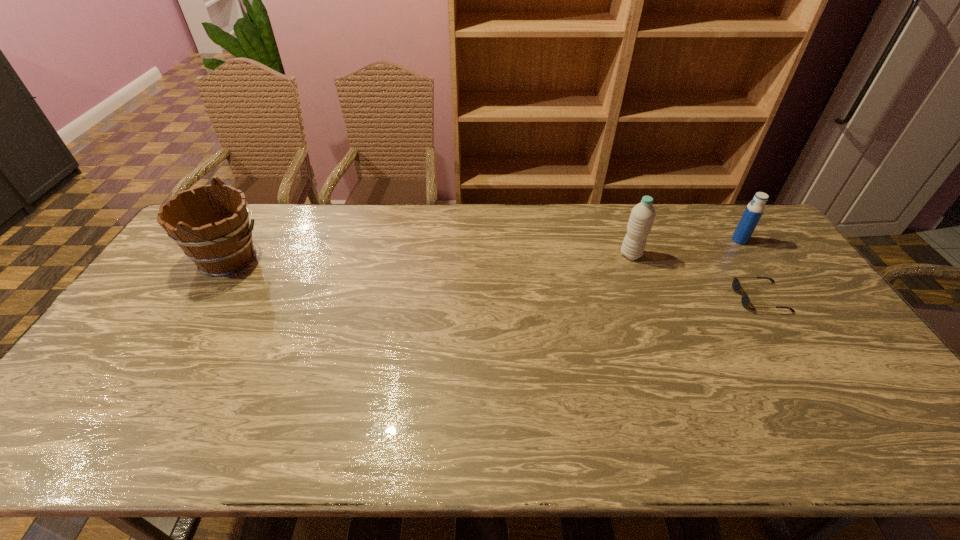
Identify the location of free space between the left water bottle and the sunglasses. (696, 276).

Where is `blank region between the wine bucket and the sunglasses`? This screenshot has height=540, width=960. blank region between the wine bucket and the sunglasses is located at coordinates (494, 278).

You are a GUI agent. You are given a task and a screenshot of the screen. Output one action in this format:
    pyautogui.click(x=<x>, y=<y>)
    Task: Click on the vacant area between the farther water bottle and the wine bucket
    
    Given the screenshot: What is the action you would take?
    pyautogui.click(x=484, y=249)

At what (x,y) coordinates should I click in order to perform the action: click on vacant area that lies between the leftmost object and the second shortest object. Please return your answer as a coordinate pair (x, y). Image resolution: width=960 pixels, height=540 pixels. Looking at the image, I should click on pos(484,249).

This screenshot has height=540, width=960. I want to click on unoccupied area between the nearer water bottle and the sunglasses, so click(696, 276).

This screenshot has width=960, height=540. What are the coordinates of `free space between the third tallest object and the leftmost object` in the screenshot? It's located at (484, 249).

What are the coordinates of `the closest object to the wine bucket` in the screenshot? It's located at (642, 216).

Identify which object is the nearest to the wine bucket. Please provide its 2D coordinates. Your answer should be formatted as a tuple, i.e. [(x, y)], where the tuple contains the x and y coordinates of a point satisfying the conditions above.

[(642, 216)]

This screenshot has width=960, height=540. Find the location of `free space that satisfies the following two spatial constraints: 1. on the front side of the shorter water bottle; 2. on the front-facing side of the sunglasses`. free space that satisfies the following two spatial constraints: 1. on the front side of the shorter water bottle; 2. on the front-facing side of the sunglasses is located at coordinates (778, 297).

Find the location of `vacant space that satisfies the following two spatial constraints: 1. on the front side of the shorter water bottle; 2. with the handle on the leftmost object`. vacant space that satisfies the following two spatial constraints: 1. on the front side of the shorter water bottle; 2. with the handle on the leftmost object is located at coordinates (752, 259).